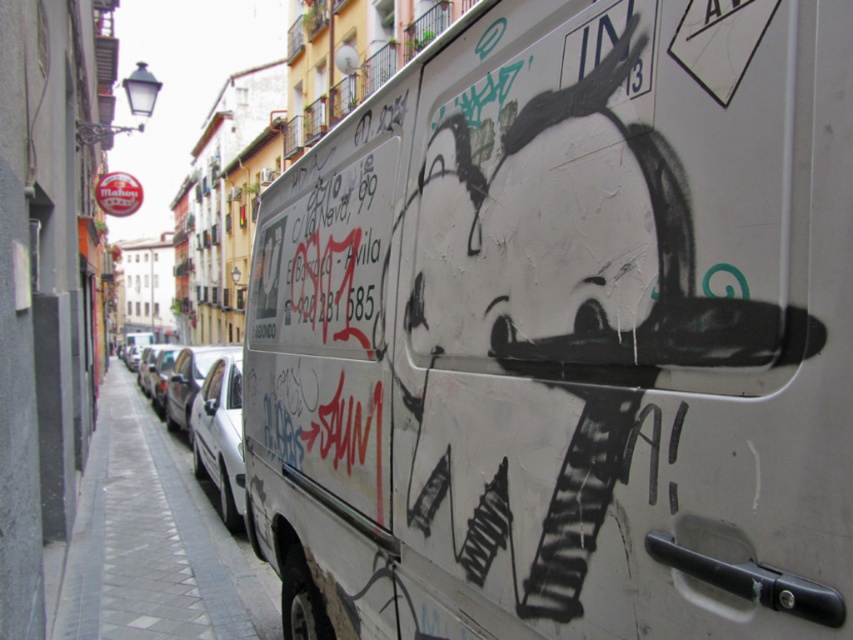
Question: Can you confirm if white matte van at center is wider than gray tile pavement at lower left?

Choices:
 (A) yes
 (B) no

Answer: (B)

Question: Can you confirm if white matte van at center is positioned above gray tile pavement at lower left?

Choices:
 (A) no
 (B) yes

Answer: (B)

Question: Which object is closer to the camera taking this photo?

Choices:
 (A) white matte van at center
 (B) gray tile pavement at lower left

Answer: (A)

Question: Which object is closer to the camera taking this photo?

Choices:
 (A) white matte van at center
 (B) gray tile pavement at lower left

Answer: (A)

Question: Does white matte van at center have a larger size compared to gray tile pavement at lower left?

Choices:
 (A) yes
 (B) no

Answer: (B)